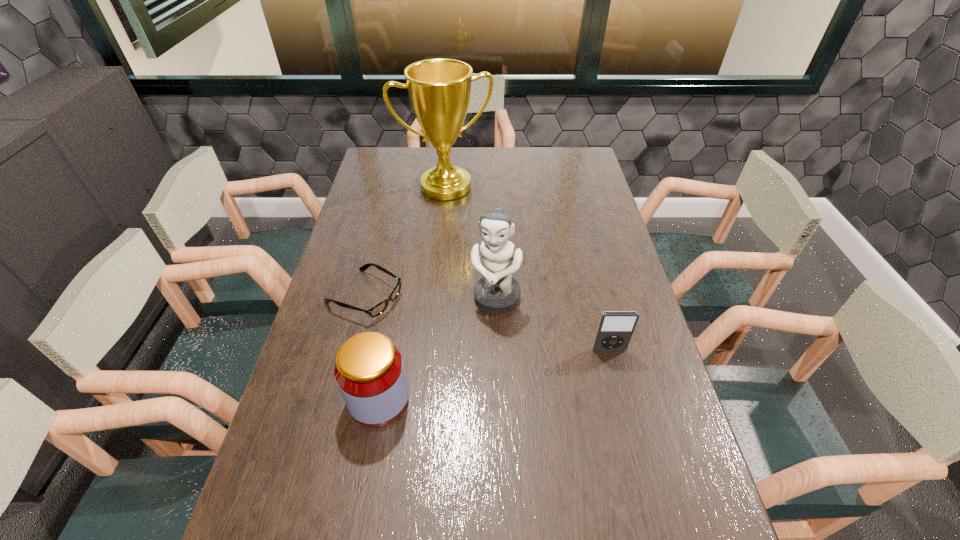
Where is `the third shortest object`? The width and height of the screenshot is (960, 540). the third shortest object is located at coordinates (369, 371).

Find the location of a particular element. the nearest object is located at coordinates (369, 371).

Identify the location of the fourth tallest object. The image size is (960, 540). (615, 329).

You are a GUI agent. You are given a task and a screenshot of the screen. Output one action in this format:
    pyautogui.click(x=<x>, y=<y>)
    Task: Click on the rightmost object
    
    Given the screenshot: What is the action you would take?
    [615, 329]

Identify the location of the tallest object. The width and height of the screenshot is (960, 540). (439, 90).

Find the location of `the farthest object`. the farthest object is located at coordinates (439, 90).

The image size is (960, 540). I want to click on figurine, so click(497, 291).

The width and height of the screenshot is (960, 540). What are the coordinates of `spectacles` in the screenshot? It's located at (375, 311).

The height and width of the screenshot is (540, 960). I want to click on free region located 0.080m on the front of the jar, so click(368, 463).

At what (x,y) coordinates should I click in order to perform the action: click on vacant space situated on the front-facing side of the second nearest object. Please return your answer as a coordinate pair (x, y). The height and width of the screenshot is (540, 960). Looking at the image, I should click on (616, 382).